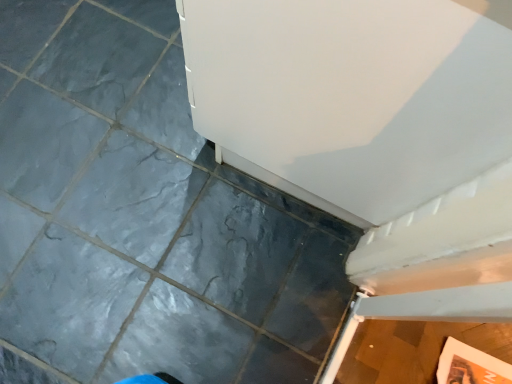
The width and height of the screenshot is (512, 384). What are the coordinates of `white glossy cabinet at upper right` in the screenshot? It's located at (373, 137).

The height and width of the screenshot is (384, 512). What do you see at coordinates (373, 137) in the screenshot? I see `white glossy cabinet at upper right` at bounding box center [373, 137].

The height and width of the screenshot is (384, 512). Find the location of `white glossy cabinet at upper right`. white glossy cabinet at upper right is located at coordinates (373, 137).